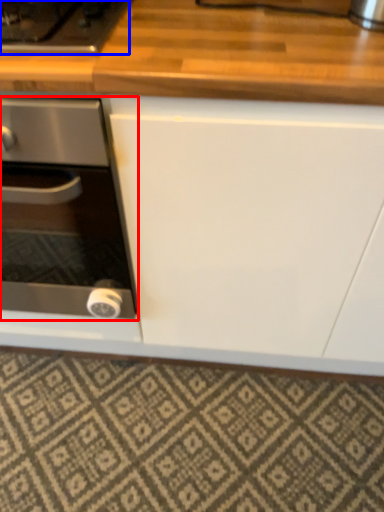
Question: Which point is further to the camera, kitchen appliance (highlighted by a red box) or gas stove (highlighted by a blue box)?

Choices:
 (A) kitchen appliance
 (B) gas stove

Answer: (B)